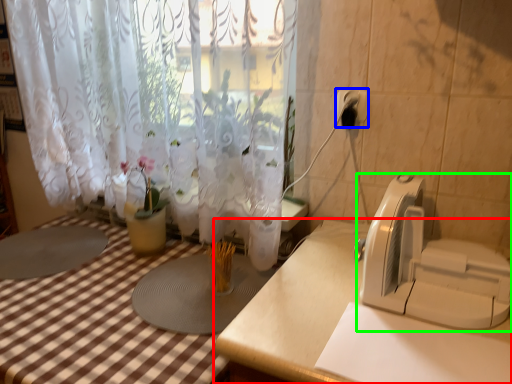
Question: Which object is positioned farthest from table (highlighted by a red box)? Select from electric outlet (highlighted by a blue box) and appliance (highlighted by a green box).

Choices:
 (A) electric outlet
 (B) appliance

Answer: (A)